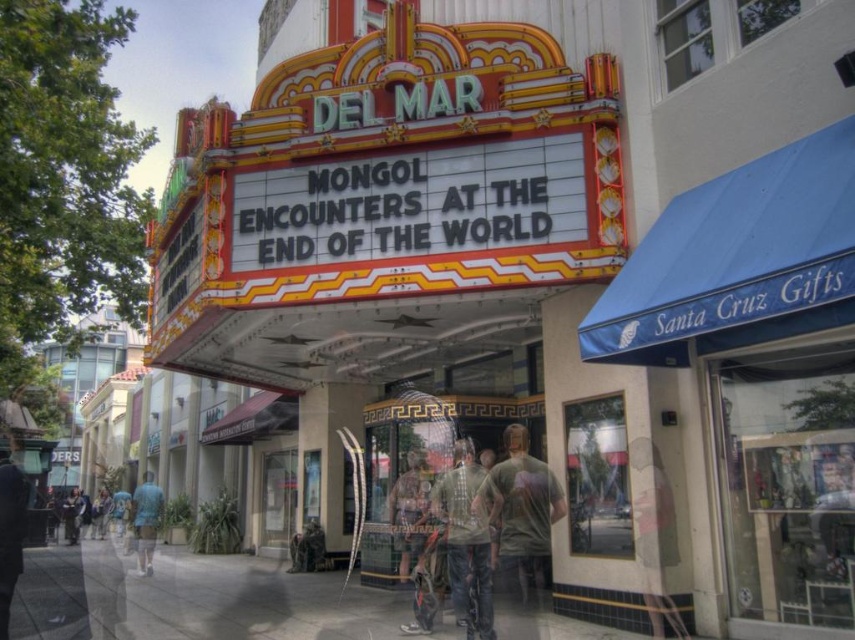
Is dark gray jacket at lower left shorter than camouflage jacket at center?

In fact, dark gray jacket at lower left may be taller than camouflage jacket at center.

Locate an element on the screen. dark gray jacket at lower left is located at coordinates (10, 536).

Identify the location of dark gray jacket at lower left. (10, 536).

Who is more distant from viewer, (140,556) or (72,492)?

The point (72,492) is behind.

Based on the photo, who is higher up, light blue shirt at lower left or dark blue jeans at lower left?

light blue shirt at lower left

Is point (151, 515) in front of point (81, 497)?

Yes, it is.

Where is `light blue shirt at lower left`? The image size is (855, 640). light blue shirt at lower left is located at coordinates (145, 520).

Can you confirm if camouflage t-shirt at center is taller than light blue shirt at lower left?

Incorrect, camouflage t-shirt at center's height is not larger of light blue shirt at lower left's.

Between camouflage t-shirt at center and light blue shirt at lower left, which one has more height?

Standing taller between the two is light blue shirt at lower left.

In order to click on camouflage t-shirt at center in this screenshot , I will do `click(466, 540)`.

Locate an element on the screen. camouflage t-shirt at center is located at coordinates (466, 540).